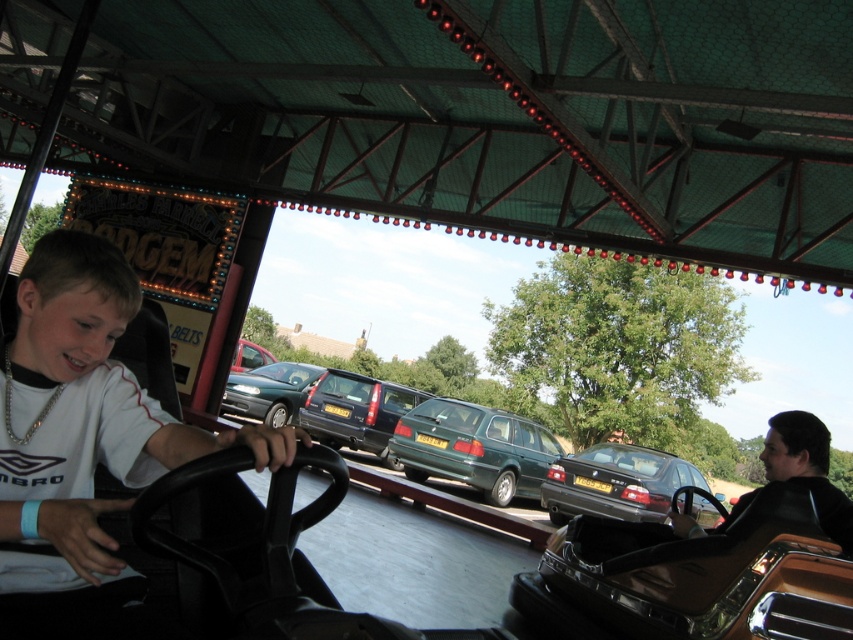
Does point (178, 458) come behind point (679, 624)?

No.

Describe the element at coordinates (84, 444) in the screenshot. I see `white matte shirt at center` at that location.

Locate an element on the screen. The width and height of the screenshot is (853, 640). white matte shirt at center is located at coordinates (84, 444).

The image size is (853, 640). In order to click on white matte shirt at center in this screenshot , I will do `click(84, 444)`.

Does metallic blue car at center come behind metallic silver car at center?

Yes, metallic blue car at center is further from the viewer.

Who is more forward, (x=389, y=461) or (x=244, y=364)?

Point (x=389, y=461) is in front.

Locate an element on the screen. The height and width of the screenshot is (640, 853). metallic blue car at center is located at coordinates (357, 412).

Who is higher up, shiny black sedan at center or shiny black car at right?

shiny black car at right is higher up.

Who is positioned more to the right, shiny black sedan at center or shiny black car at right?

From the viewer's perspective, shiny black sedan at center appears more on the right side.

This screenshot has width=853, height=640. What are the coordinates of `shiny black sedan at center` in the screenshot? It's located at (614, 483).